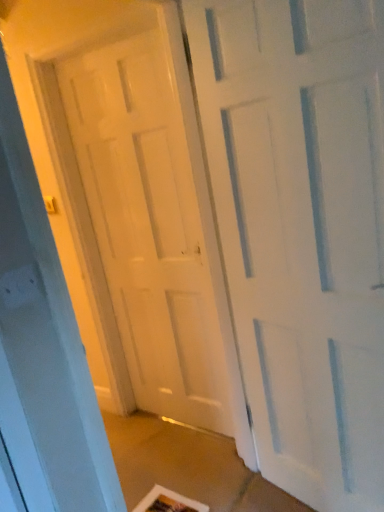
Question: Which direction should I rotate to look at white matte door at center, which is counted as the second door, starting from the back?

Choices:
 (A) right
 (B) left

Answer: (A)

Question: Does white matte door at center, which is counted as the second door, starting from the back, appear on the left side of white glossy door at center, positioned as the 2th door in front-to-back order?

Choices:
 (A) yes
 (B) no

Answer: (B)

Question: Is white matte door at center, which is counted as the second door, starting from the back, positioned with its back to white glossy door at center, positioned as the 2th door in front-to-back order?

Choices:
 (A) yes
 (B) no

Answer: (B)

Question: From a real-world perspective, is white matte door at center, which is the first door in front-to-back order, located beneath white glossy door at center, positioned as the 2th door in front-to-back order?

Choices:
 (A) yes
 (B) no

Answer: (A)

Question: Does white matte door at center, which is the first door in front-to-back order, appear on the right side of white glossy door at center, positioned as the 2th door in front-to-back order?

Choices:
 (A) no
 (B) yes

Answer: (B)

Question: Is white matte door at center, which is counted as the second door, starting from the back, surrounding white glossy door at center, positioned as the 2th door in front-to-back order?

Choices:
 (A) yes
 (B) no

Answer: (B)

Question: Does white matte door at center, which is counted as the second door, starting from the back, have a larger size compared to white glossy door at center, the first door from the back?

Choices:
 (A) no
 (B) yes

Answer: (B)

Question: Is white glossy door at center, the first door from the back, at the left side of white matte door at center, which is counted as the second door, starting from the back?

Choices:
 (A) no
 (B) yes

Answer: (B)

Question: From a real-world perspective, is white glossy door at center, the first door from the back, on top of white matte door at center, which is the first door in front-to-back order?

Choices:
 (A) yes
 (B) no

Answer: (A)

Question: Could you tell me if white glossy door at center, positioned as the 2th door in front-to-back order, is turned towards white matte door at center, which is the first door in front-to-back order?

Choices:
 (A) no
 (B) yes

Answer: (A)

Question: Considering the relative sizes of white glossy door at center, positioned as the 2th door in front-to-back order, and white matte door at center, which is counted as the second door, starting from the back, in the image provided, is white glossy door at center, positioned as the 2th door in front-to-back order, taller than white matte door at center, which is counted as the second door, starting from the back,?

Choices:
 (A) yes
 (B) no

Answer: (A)

Question: Is white glossy door at center, the first door from the back, positioned far away from white matte door at center, which is the first door in front-to-back order?

Choices:
 (A) yes
 (B) no

Answer: (B)

Question: Is white glossy door at center, the first door from the back, directly adjacent to white matte door at center, which is counted as the second door, starting from the back?

Choices:
 (A) yes
 (B) no

Answer: (B)

Question: In the image, is white glossy door at center, positioned as the 2th door in front-to-back order, positioned in front of or behind white matte door at center, which is counted as the second door, starting from the back?

Choices:
 (A) behind
 (B) front

Answer: (A)